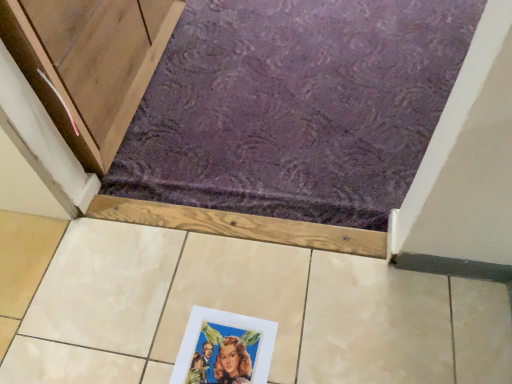
I want to click on empty space that is ontop of matte paper picture frame at lower center (from a real-world perspective), so click(217, 352).